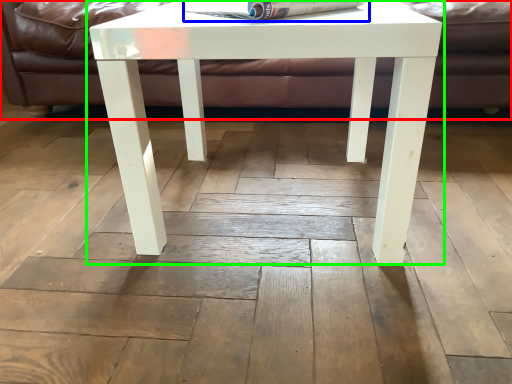
Question: Which object is the farthest from couch (highlighted by a red box)? Choose among these: magazine (highlighted by a blue box) or table (highlighted by a green box).

Choices:
 (A) magazine
 (B) table

Answer: (A)